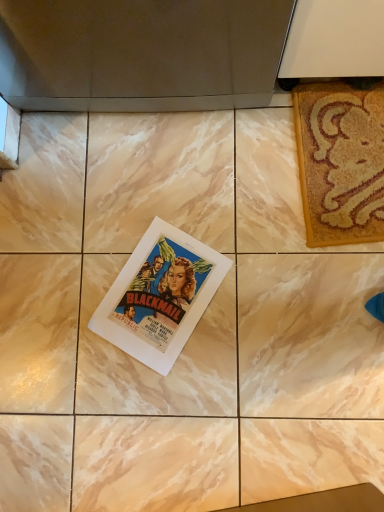
Where is `vacant space to the right of white paper at center`? The width and height of the screenshot is (384, 512). vacant space to the right of white paper at center is located at coordinates (264, 265).